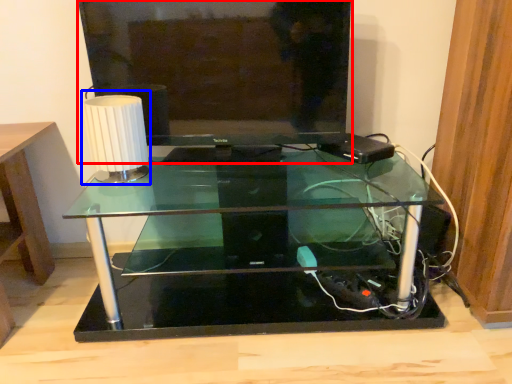
Question: Which object is further to the camera taking this photo, television (highlighted by a red box) or table lamp (highlighted by a blue box)?

Choices:
 (A) television
 (B) table lamp

Answer: (B)